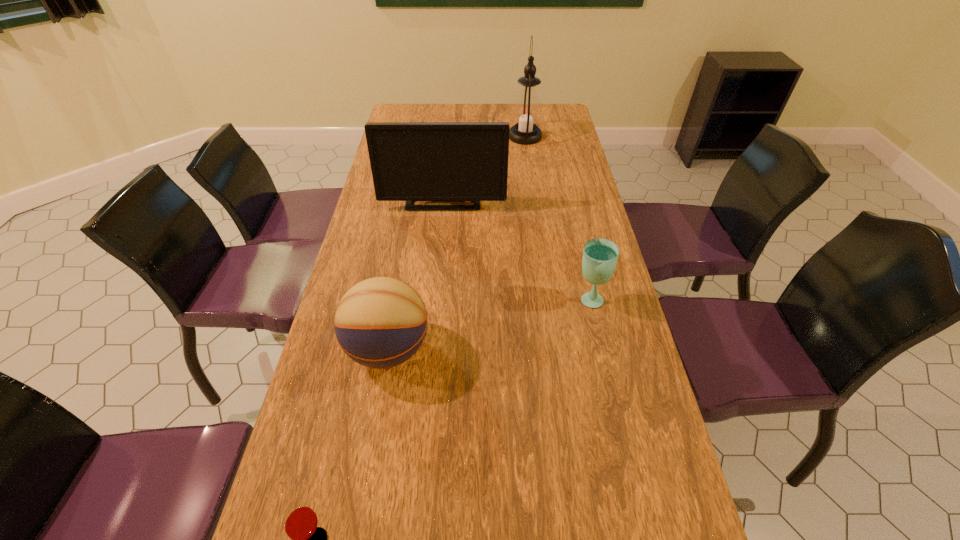
Find the location of `vacant position at the far left corner of the desktop`. vacant position at the far left corner of the desktop is located at coordinates (406, 113).

The image size is (960, 540). What are the coordinates of `free space between the basketball and the right glass` in the screenshot? It's located at (489, 323).

This screenshot has height=540, width=960. Identify the location of free space between the farthest object and the right glass. (557, 218).

Locate an element on the screen. The height and width of the screenshot is (540, 960). free space between the taller glass and the fourth nearest object is located at coordinates (516, 248).

Where is `free spot between the second farthest object and the third nearest object`? The height and width of the screenshot is (540, 960). free spot between the second farthest object and the third nearest object is located at coordinates (516, 248).

This screenshot has height=540, width=960. I want to click on free space between the taller glass and the fourth nearest object, so click(x=516, y=248).

The image size is (960, 540). Identify the location of free space between the tallest object and the right glass. (557, 218).

Locate an element on the screen. This screenshot has height=540, width=960. free area in between the second nearest object and the computer monitor is located at coordinates (416, 273).

Locate which object ranks fourth in proximity to the farthest object. Please provide its 2D coordinates. Your answer should be formatted as a tuple, i.e. [(x, y)], where the tuple contains the x and y coordinates of a point satisfying the conditions above.

[(300, 522)]

I want to click on the third closest object relative to the taller glass, so click(x=300, y=522).